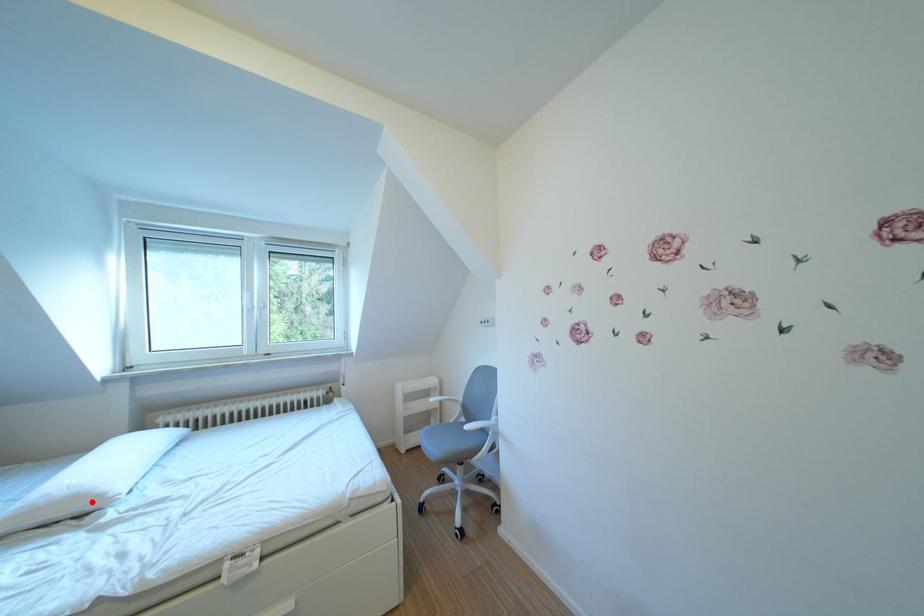
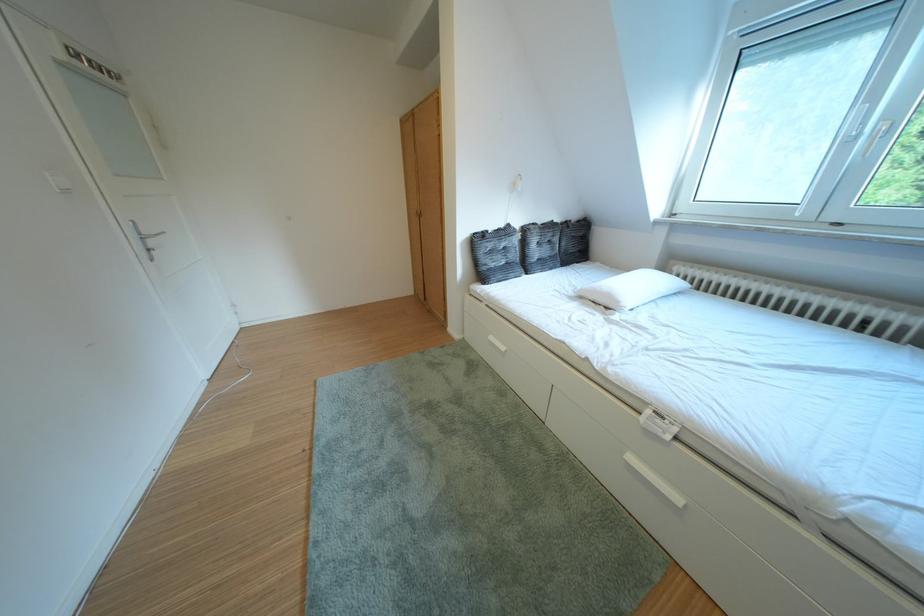
Find the pixel in the second image that matches the highlighted location in the first image.

(623, 301)